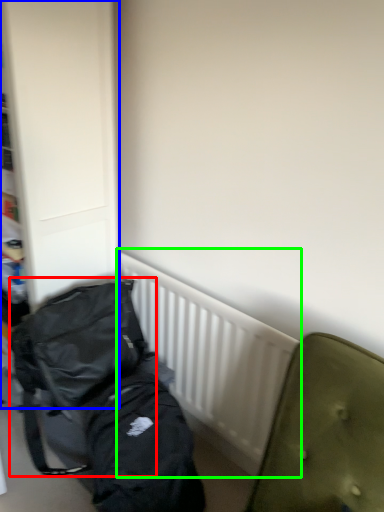
Question: Which is farther away from backpack (highlighted by a red box)? dresser (highlighted by a blue box) or radiator (highlighted by a green box)?

Choices:
 (A) dresser
 (B) radiator

Answer: (A)